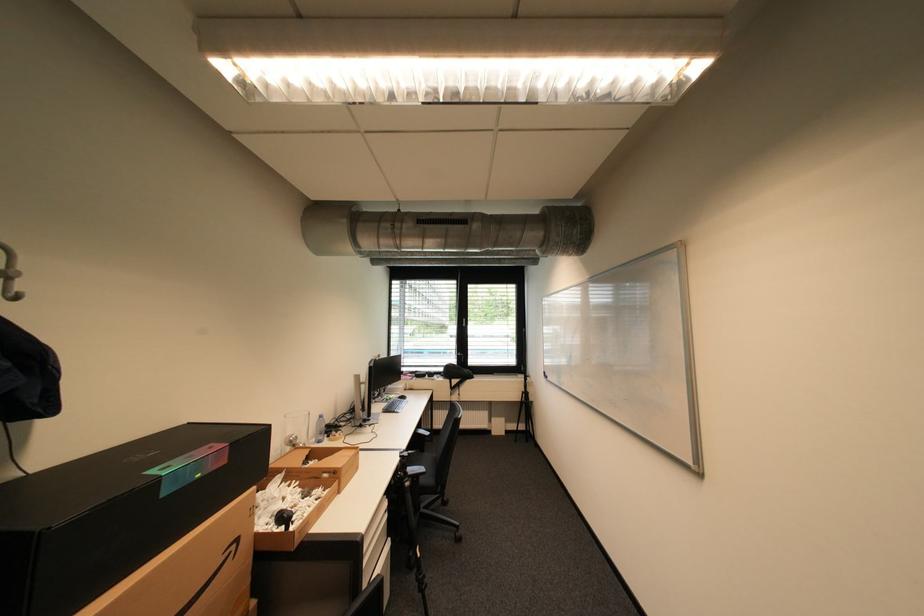
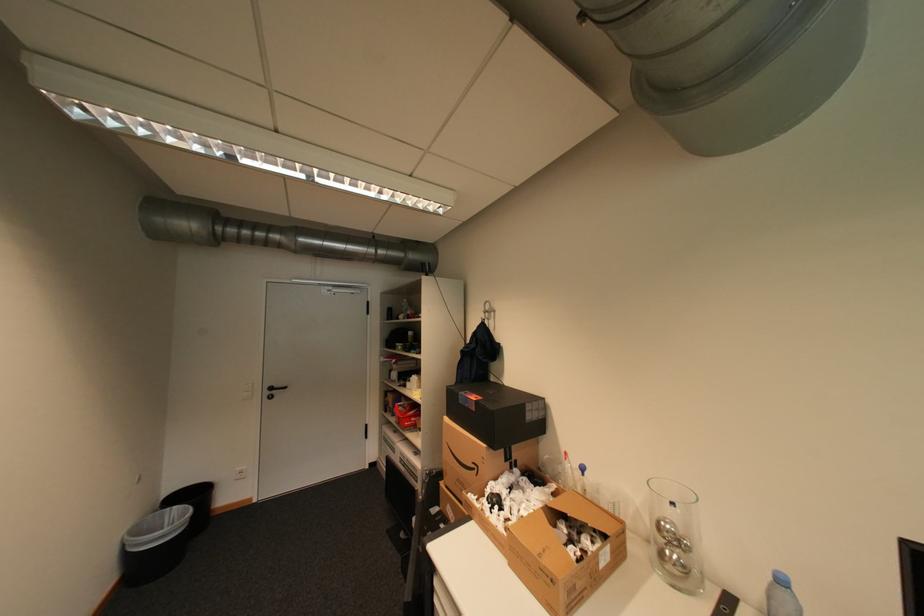
Find the pixel in the second image that matches point 330,416 in the first image.

(791, 582)